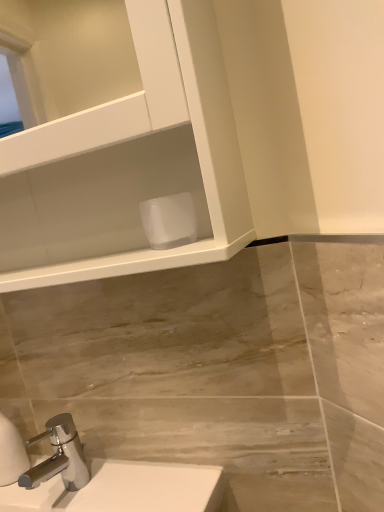
Question: Is white matte toilet paper at lower center located outside chrome metallic faucet at lower left?

Choices:
 (A) no
 (B) yes

Answer: (B)

Question: Does white matte toilet paper at lower center have a lesser width compared to chrome metallic faucet at lower left?

Choices:
 (A) yes
 (B) no

Answer: (A)

Question: Can you confirm if white matte toilet paper at lower center is positioned to the left of chrome metallic faucet at lower left?

Choices:
 (A) no
 (B) yes

Answer: (A)

Question: From a real-world perspective, is white matte toilet paper at lower center located beneath chrome metallic faucet at lower left?

Choices:
 (A) no
 (B) yes

Answer: (A)

Question: Does white matte toilet paper at lower center have a lesser height compared to chrome metallic faucet at lower left?

Choices:
 (A) no
 (B) yes

Answer: (B)

Question: Is chrome metallic faucet at lower left at the back of white matte toilet paper at lower center?

Choices:
 (A) yes
 (B) no

Answer: (B)

Question: Could you tell me if chrome metallic faucet at lower left is facing white matte toilet paper at lower center?

Choices:
 (A) yes
 (B) no

Answer: (B)

Question: Are chrome metallic faucet at lower left and white matte toilet paper at lower center located far from each other?

Choices:
 (A) no
 (B) yes

Answer: (A)

Question: Would you say chrome metallic faucet at lower left is outside white matte toilet paper at lower center?

Choices:
 (A) no
 (B) yes

Answer: (B)

Question: Is chrome metallic faucet at lower left further to camera compared to white matte toilet paper at lower center?

Choices:
 (A) no
 (B) yes

Answer: (B)

Question: Can you confirm if chrome metallic faucet at lower left is smaller than white matte toilet paper at lower center?

Choices:
 (A) yes
 (B) no

Answer: (B)

Question: Can white matte toilet paper at lower center be found inside chrome metallic faucet at lower left?

Choices:
 (A) no
 (B) yes

Answer: (A)

Question: From their relative heights in the image, would you say chrome metallic faucet at lower left is taller or shorter than white matte toilet paper at lower center?

Choices:
 (A) tall
 (B) short

Answer: (A)